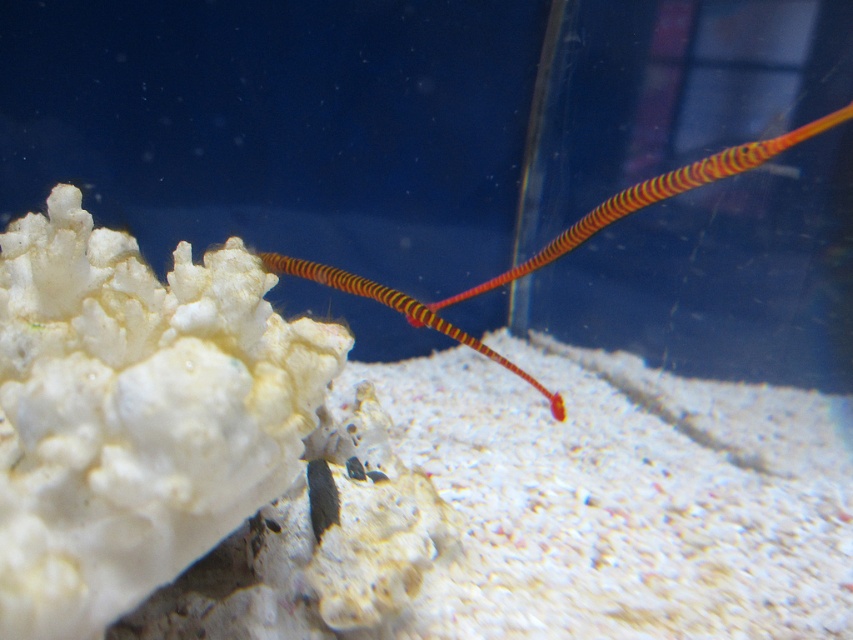
Who is positioned more to the right, white porous coral at upper left or orange striped pipefish at center?

orange striped pipefish at center

Does white porous coral at upper left appear on the left side of orange striped pipefish at center?

Yes, white porous coral at upper left is to the left of orange striped pipefish at center.

Locate an element on the screen. The width and height of the screenshot is (853, 640). white porous coral at upper left is located at coordinates (135, 413).

Identify the location of white porous coral at upper left. This screenshot has height=640, width=853. (135, 413).